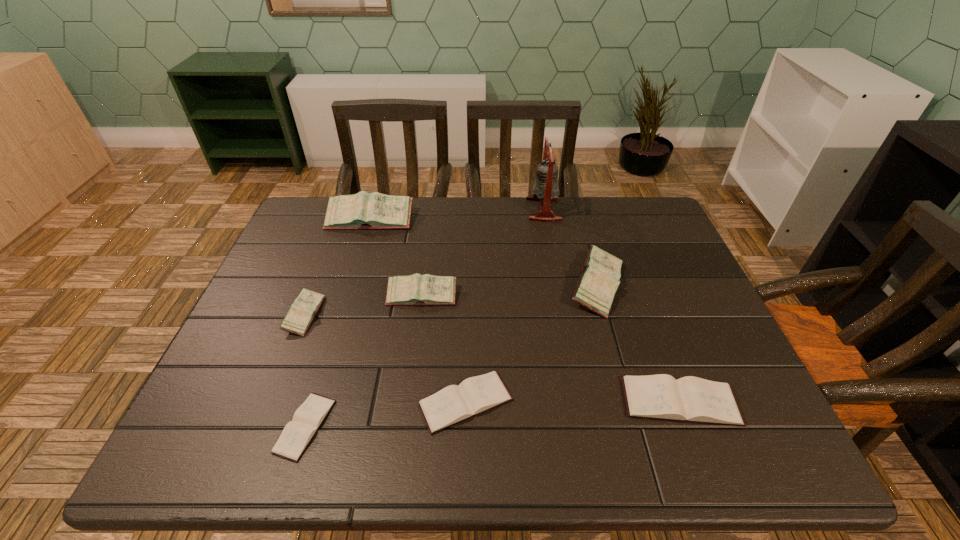
Locate which brown diary ranks in proximity to the third smallest pink diary. Please provide its 2D coordinates. Your answer should be formatted as a tuple, i.e. [(x, y)], where the tuple contains the x and y coordinates of a point satisfying the conditions above.

[(688, 399)]

Choose which brown diary is the second nearest neighbor to the tallest diary. Please provide its 2D coordinates. Your answer should be formatted as a tuple, i.e. [(x, y)], where the tuple contains the x and y coordinates of a point satisfying the conditions above.

[(297, 434)]

Identify the location of free space that satisfies the following two spatial constraints: 1. on the front side of the farthest pink diary; 2. on the left side of the fifth shortest object. (347, 296).

Identify the location of free location that satisfies the following two spatial constraints: 1. on the back side of the fifth shortest diary; 2. on the right side of the fourth shortest diary. (312, 296).

Where is `vacant space that satisfies the following two spatial constraints: 1. on the back side of the tallest object; 2. on the right side of the third biggest pink diary`? vacant space that satisfies the following two spatial constraints: 1. on the back side of the tallest object; 2. on the right side of the third biggest pink diary is located at coordinates (433, 210).